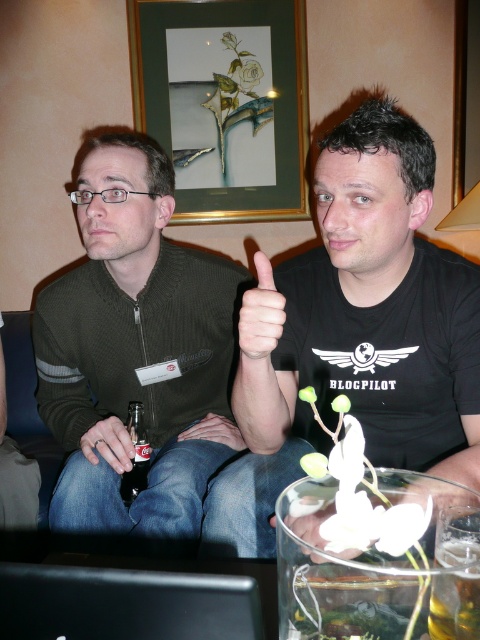
Can you confirm if gold-framed picture at upper center is taller than clear glass bottle at lower center?

Correct, gold-framed picture at upper center is much taller as clear glass bottle at lower center.

Who is more distant from viewer, (232, 220) or (471, 573)?

Positioned behind is point (232, 220).

This screenshot has height=640, width=480. I want to click on gold-framed picture at upper center, so click(225, 102).

Which is behind, point (254, 442) or point (283, 12)?

Positioned behind is point (283, 12).

Between point (259, 300) and point (216, 61), which one is positioned in front?

Point (259, 300) is in front.

Where is `black matte shirt at center`? This screenshot has height=640, width=480. black matte shirt at center is located at coordinates pyautogui.click(x=358, y=330).

Does black matte laptop at lower center have a larger size compared to clear glass bottle at lower center?

Actually, black matte laptop at lower center might be smaller than clear glass bottle at lower center.

Between point (121, 572) and point (440, 545), which one is positioned behind?

Point (440, 545)

I want to click on black matte laptop at lower center, so click(124, 604).